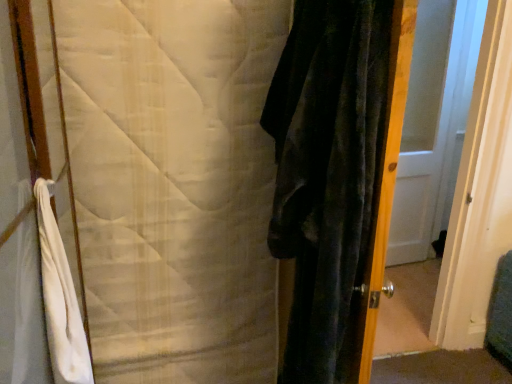
The width and height of the screenshot is (512, 384). Identify the location of white quilted blanket at left. (174, 184).

The width and height of the screenshot is (512, 384). Describe the element at coordinates (174, 184) in the screenshot. I see `white quilted blanket at left` at that location.

Image resolution: width=512 pixels, height=384 pixels. What do you see at coordinates (60, 298) in the screenshot?
I see `white cotton bath towel at left` at bounding box center [60, 298].

What do you see at coordinates (463, 221) in the screenshot? This screenshot has width=512, height=384. I see `velvet dark green screen door at right` at bounding box center [463, 221].

The width and height of the screenshot is (512, 384). In order to click on velvet dark green screen door at right in this screenshot , I will do `click(463, 221)`.

This screenshot has height=384, width=512. What do you see at coordinates (434, 123) in the screenshot?
I see `white glossy door at center` at bounding box center [434, 123].

Where is `white quilted blanket at left`? The width and height of the screenshot is (512, 384). white quilted blanket at left is located at coordinates (174, 184).

From a real-world perspective, is white cotton bath towel at left on white quilted blanket at left?

Yes, from a real-world perspective, white cotton bath towel at left is on top of white quilted blanket at left.

From the image's perspective, which is below, white cotton bath towel at left or white quilted blanket at left?

white cotton bath towel at left, from the image's perspective.

Can you confirm if white cotton bath towel at left is bigger than white quilted blanket at left?

Incorrect, white cotton bath towel at left is not larger than white quilted blanket at left.

Is the surface of white cotton bath towel at left in direct contact with white quilted blanket at left?

No, white cotton bath towel at left is not making contact with white quilted blanket at left.

Choose the correct answer: Is velvet dark green screen door at right inside white cotton bath towel at left or outside it?

velvet dark green screen door at right lies outside white cotton bath towel at left.

From the image's perspective, which one is positioned higher, velvet dark green screen door at right or white cotton bath towel at left?

velvet dark green screen door at right.

Consider the image. How different are the orientations of velvet dark green screen door at right and white cotton bath towel at left in degrees?

The angular difference between velvet dark green screen door at right and white cotton bath towel at left is 80.2 degrees.

Which of these two, velvet dark green screen door at right or white cotton bath towel at left, is thinner?

Thinner between the two is white cotton bath towel at left.

From the image's perspective, which one is positioned higher, white quilted blanket at left or white cotton bath towel at left?

white quilted blanket at left is shown above in the image.

Would you consider white quilted blanket at left to be distant from white cotton bath towel at left?

white quilted blanket at left is near white cotton bath towel at left, not far away.

Looking at the image, does white quilted blanket at left seem bigger or smaller compared to white cotton bath towel at left?

Considering their sizes, white quilted blanket at left takes up more space than white cotton bath towel at left.

Considering the relative positions of white quilted blanket at left and white cotton bath towel at left in the image provided, is white quilted blanket at left behind white cotton bath towel at left?

Yes, white quilted blanket at left is further from the camera.

Is white glossy door at center at the right side of velvet dark green screen door at right?

Correct, you'll find white glossy door at center to the right of velvet dark green screen door at right.

Is white glossy door at center outside of velvet dark green screen door at right?

white glossy door at center is positioned outside velvet dark green screen door at right.

How many degrees apart are the facing directions of white glossy door at center and velvet dark green screen door at right?

white glossy door at center and velvet dark green screen door at right are facing 8.41 degrees away from each other.

From a real-world perspective, is white glossy door at center above or below velvet dark green screen door at right?

white glossy door at center is situated higher than velvet dark green screen door at right in the real world.

Is white cotton bath towel at left outside of white glossy door at center?

white cotton bath towel at left is positioned outside white glossy door at center.

Is white cotton bath towel at left in front of white glossy door at center?

Yes.

Looking at this image, does white cotton bath towel at left have a greater width compared to white glossy door at center?

Correct, the width of white cotton bath towel at left exceeds that of white glossy door at center.

From the image's perspective, is white cotton bath towel at left located above or below white glossy door at center?

Based on their image positions, white cotton bath towel at left is located beneath white glossy door at center.

Consider the image. From the image's perspective, who appears lower, white quilted blanket at left or white glossy door at center?

white quilted blanket at left appears lower in the image.

Are white quilted blanket at left and white glossy door at center beside each other?

white quilted blanket at left is not next to white glossy door at center, and they're not touching.

Identify the location of door above the white quilted blanket at left (from the image's perspective). The width and height of the screenshot is (512, 384). (434, 123).

Considering the relative sizes of velvet dark green screen door at right and white quilted blanket at left in the image provided, is velvet dark green screen door at right wider than white quilted blanket at left?

Yes.

Is velvet dark green screen door at right taller than white quilted blanket at left?

Indeed, velvet dark green screen door at right has a greater height compared to white quilted blanket at left.

Which is less distant, (498, 249) or (257, 177)?

Point (498, 249).

Are velvet dark green screen door at right and white quilted blanket at left far apart?

Absolutely, velvet dark green screen door at right is distant from white quilted blanket at left.

Find the location of `blanket lying above the white cotton bath towel at left (from the image's perspective)`. blanket lying above the white cotton bath towel at left (from the image's perspective) is located at coordinates (174, 184).

Where is `bath towel located above the velvet dark green screen door at right (from a real-world perspective)`? This screenshot has width=512, height=384. bath towel located above the velvet dark green screen door at right (from a real-world perspective) is located at coordinates (60, 298).

When comparing their distances from white cotton bath towel at left, does white quilted blanket at left or white glossy door at center seem closer?

white quilted blanket at left is closer to white cotton bath towel at left.

When comparing their distances from white glossy door at center, does white cotton bath towel at left or white quilted blanket at left seem closer?

Based on the image, white quilted blanket at left appears to be nearer to white glossy door at center.

From the image, which object appears to be nearer to velvet dark green screen door at right, white cotton bath towel at left or white glossy door at center?

white glossy door at center.

From the image, which object appears to be nearer to white cotton bath towel at left, white quilted blanket at left or velvet dark green screen door at right?

Among the two, white quilted blanket at left is located nearer to white cotton bath towel at left.

From the picture: Considering their positions, is velvet dark green screen door at right positioned closer to white cotton bath towel at left than white quilted blanket at left?

white quilted blanket at left is closer to white cotton bath towel at left.

From the image, which object appears to be nearer to white glossy door at center, white quilted blanket at left or white cotton bath towel at left?

white quilted blanket at left is positioned closer to the anchor white glossy door at center.

Estimate the real-world distances between objects in this image. Which object is closer to velvet dark green screen door at right, white quilted blanket at left or white glossy door at center?

white glossy door at center lies closer to velvet dark green screen door at right than the other object.

From the image, which object appears to be farther from white quilted blanket at left, white glossy door at center or velvet dark green screen door at right?

white glossy door at center lies further to white quilted blanket at left than the other object.

Image resolution: width=512 pixels, height=384 pixels. Identify the location of blanket located between white cotton bath towel at left and velvet dark green screen door at right in the left-right direction. (174, 184).

You are a GUI agent. You are given a task and a screenshot of the screen. Output one action in this format:
    pyautogui.click(x=<x>, y=<y>)
    Task: Click on the screen door between white quilted blanket at left and white glossy door at center in the horizontal direction
    The width and height of the screenshot is (512, 384).
    Given the screenshot: What is the action you would take?
    pyautogui.click(x=463, y=221)

You are a GUI agent. You are given a task and a screenshot of the screen. Output one action in this format:
    pyautogui.click(x=<x>, y=<y>)
    Task: Click on the screen door between white cotton bath towel at left and white glossy door at center in the front-back direction
    
    Given the screenshot: What is the action you would take?
    pyautogui.click(x=463, y=221)

Image resolution: width=512 pixels, height=384 pixels. I want to click on blanket between white cotton bath towel at left and white glossy door at center along the z-axis, so click(174, 184).